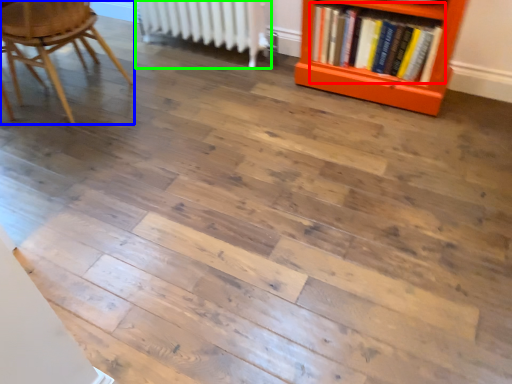
Question: Which is farther away from book (highlighted by a red box)? chair (highlighted by a blue box) or radiator (highlighted by a green box)?

Choices:
 (A) chair
 (B) radiator

Answer: (A)